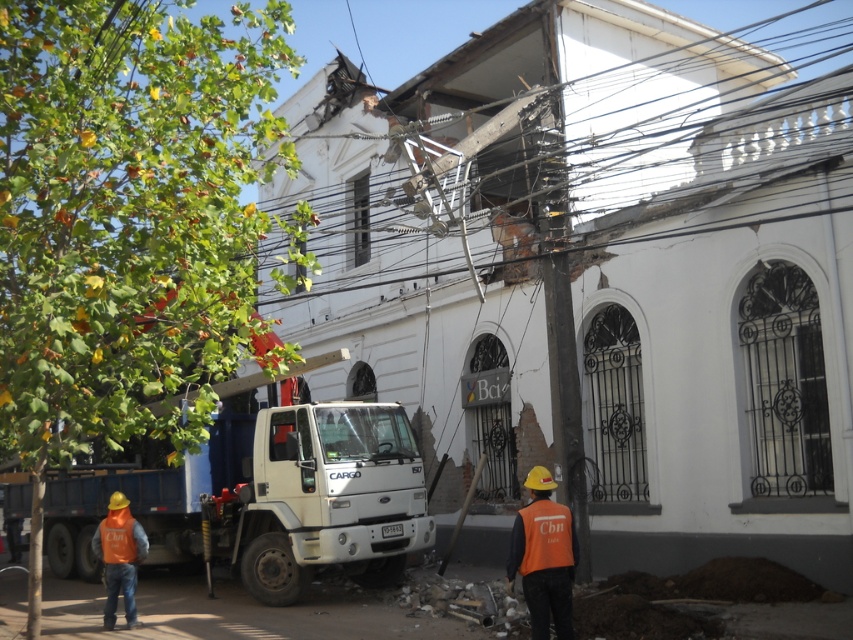
Question: Where is white matte truck at center located in relation to metallic wires at upper center in the image?

Choices:
 (A) right
 (B) left

Answer: (B)

Question: Based on their relative distances, which object is farther from the metallic wires at upper center?

Choices:
 (A) white matte truck at center
 (B) orange reflective safety vest at lower center

Answer: (A)

Question: Which object is closer to the camera taking this photo?

Choices:
 (A) orange reflective vest at lower left
 (B) metallic wires at upper center
 (C) white matte truck at center

Answer: (B)

Question: Is white matte truck at center bigger than orange reflective safety vest at lower center?

Choices:
 (A) yes
 (B) no

Answer: (B)

Question: Can you confirm if metallic wires at upper center is wider than orange reflective vest at lower left?

Choices:
 (A) yes
 (B) no

Answer: (A)

Question: Among these objects, which one is nearest to the camera?

Choices:
 (A) orange reflective vest at lower left
 (B) metallic wires at upper center

Answer: (B)